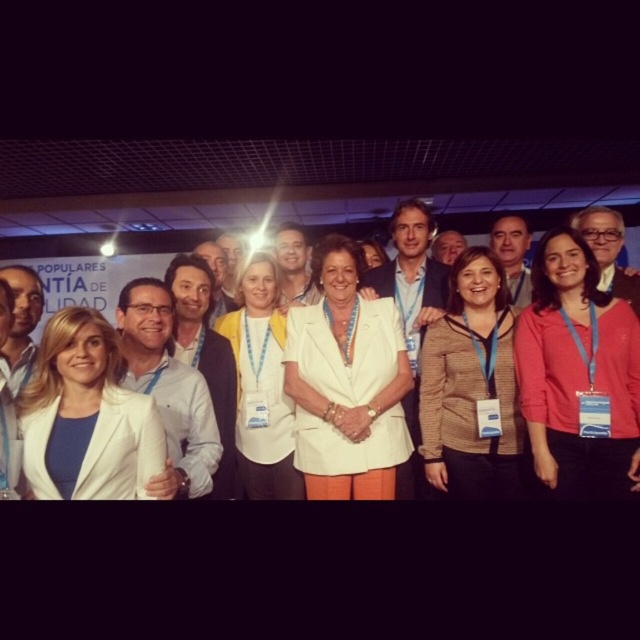
Question: Which point is farther to the camera?

Choices:
 (A) (310, 464)
 (B) (269, 380)
 (C) (4, 321)

Answer: (B)

Question: Which object appears closest to the camera in this image?

Choices:
 (A) brown textured blazer at center
 (B) white fabric jacket at left
 (C) white matte blazer at center

Answer: (B)

Question: Observing the image, what is the correct spatial positioning of white matte blazer at left in reference to white fabric jacket at left?

Choices:
 (A) left
 (B) right

Answer: (B)

Question: Does pink fabric shirt at center appear under brown textured blazer at center?

Choices:
 (A) yes
 (B) no

Answer: (B)

Question: Which object is the farthest from the pink fabric shirt at center?

Choices:
 (A) yellow fabric jacket at center
 (B) white matte blazer at center

Answer: (A)

Question: Is white matte blazer at center closer to the viewer compared to brown textured blazer at center?

Choices:
 (A) no
 (B) yes

Answer: (B)